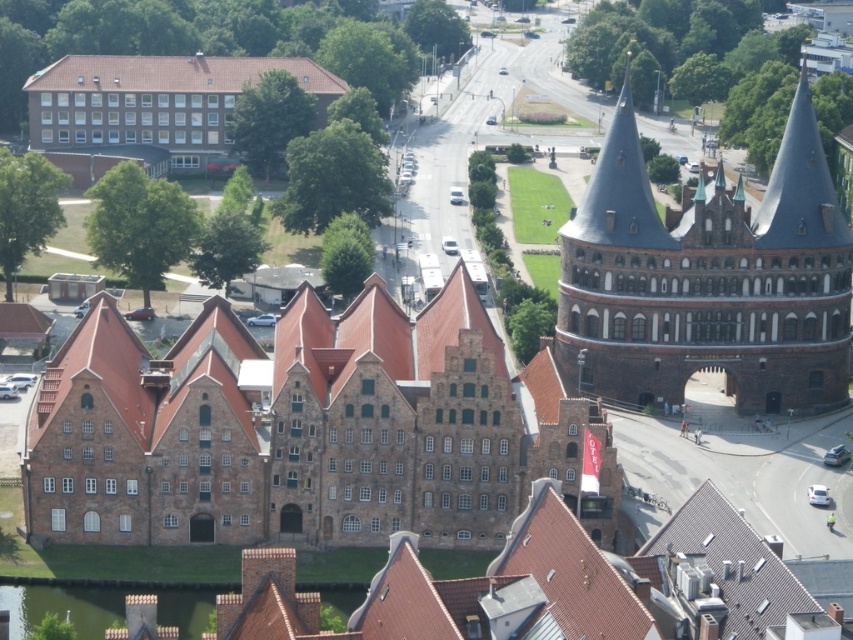
Based on the photo, measure the distance between point (177,403) and camera.

Point (177,403) is 399.97 feet from camera.

Is brown stone building at center-left to the right of dark gray stone tower at upper right from the viewer's perspective?

Incorrect, brown stone building at center-left is not on the right side of dark gray stone tower at upper right.

Locate an element on the screen. brown stone building at center-left is located at coordinates (305, 429).